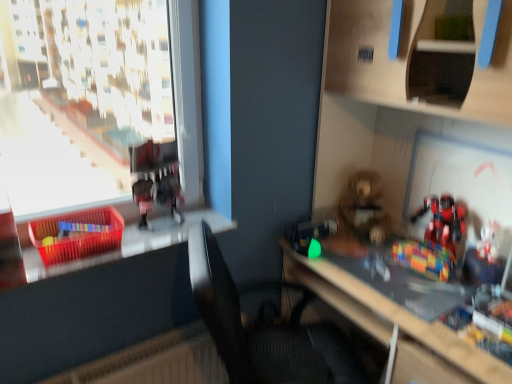
The width and height of the screenshot is (512, 384). I want to click on vacant space situated on the left part of shiny metallic robot at right, the third toy in the left-to-right sequence, so click(x=386, y=265).